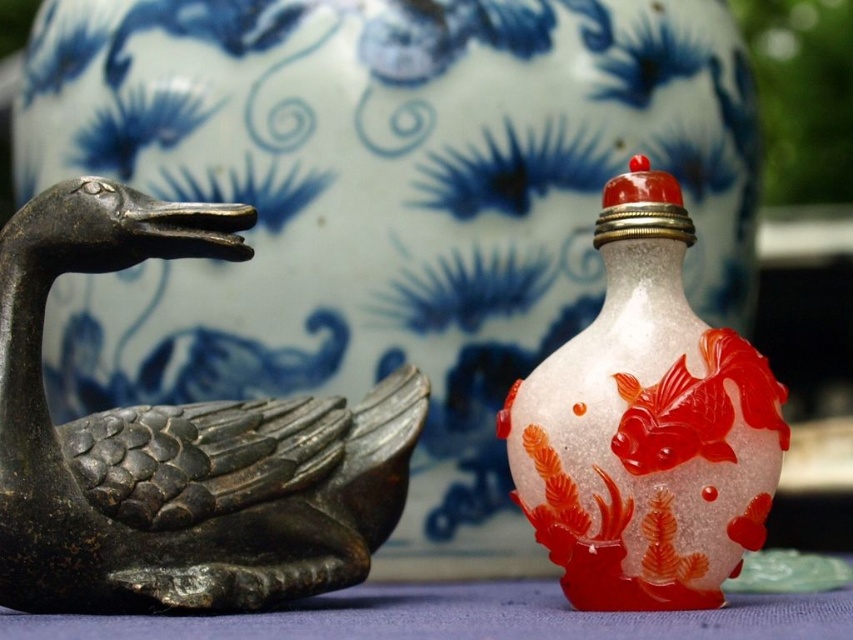
You are positioning a camera to capture the black matte goose at left and the small ornate glass bottle with a red cap. According to their positions, which object should be placed closer to the camera to ensure both are in focus?

The black matte goose at left is located at point (177,445), so to ensure both are in focus, the object closer to the camera should be the one at the lower coordinate. Since the goose is at 0.209 and the bottle is not specified, but based on the description, the bottle is to the right, which might be further away. However, without exact coordinates for the bottle, we can only confirm the goose is at 0.209. Wait, the problem states that the question must use the Objects Description provided. The Objects_D

You are arranging items on a shelf and need to place the black matte goose at left and the translucent glass snuff bottle at center. According to the image, which item should be placed higher on the shelf to match the original arrangement?

The translucent glass snuff bottle at center should be placed higher on the shelf since the black matte goose at left is located below it in the original arrangement.

You are an interior designer arranging items on a shelf. You have a black matte goose at left and a translucent glass snuff bottle at center. If you want to place both items side by side without overlapping, which item should be placed first to ensure there is enough space?

The black matte goose at left should be placed first since it is wider than the translucent glass snuff bottle at center, ensuring there is enough space for both items when placed side by side.